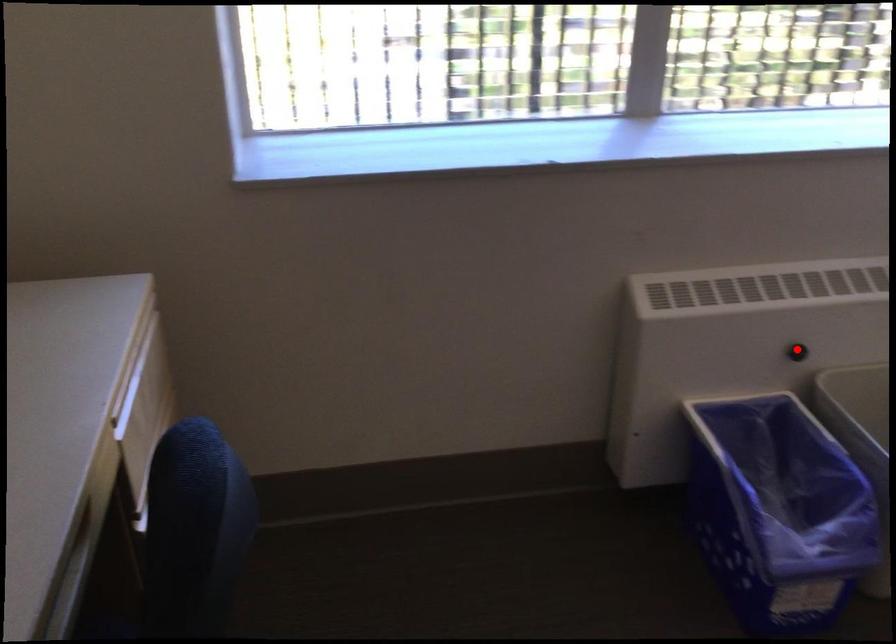
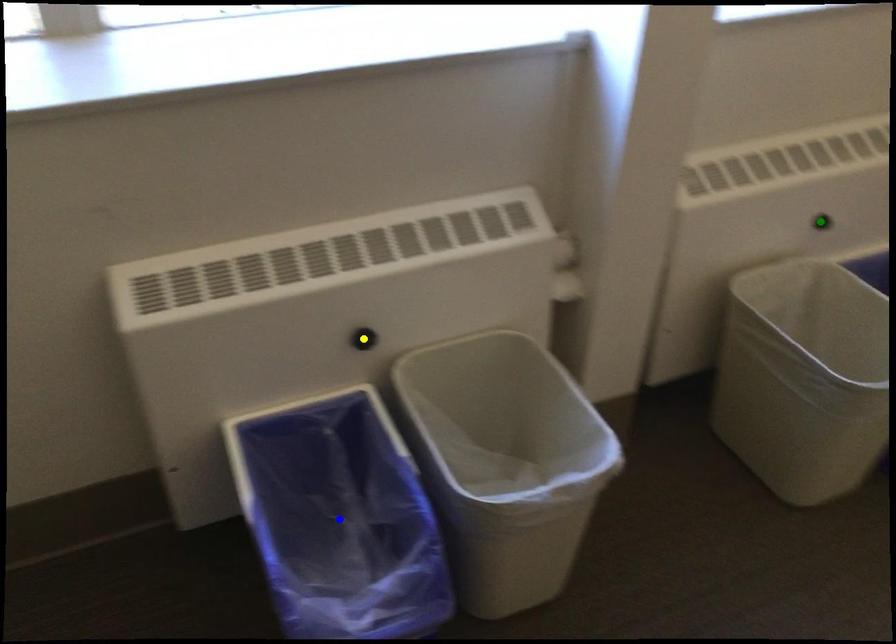
Question: I am providing you with two images of the same scene from different viewpoints. A red point is marked on the first image. You are given multiple points on the second image. Which point in image 2 is actually the same real-world point as the red point in image 1?

Choices:
 (A) blue point
 (B) yellow point
 (C) green point

Answer: (B)